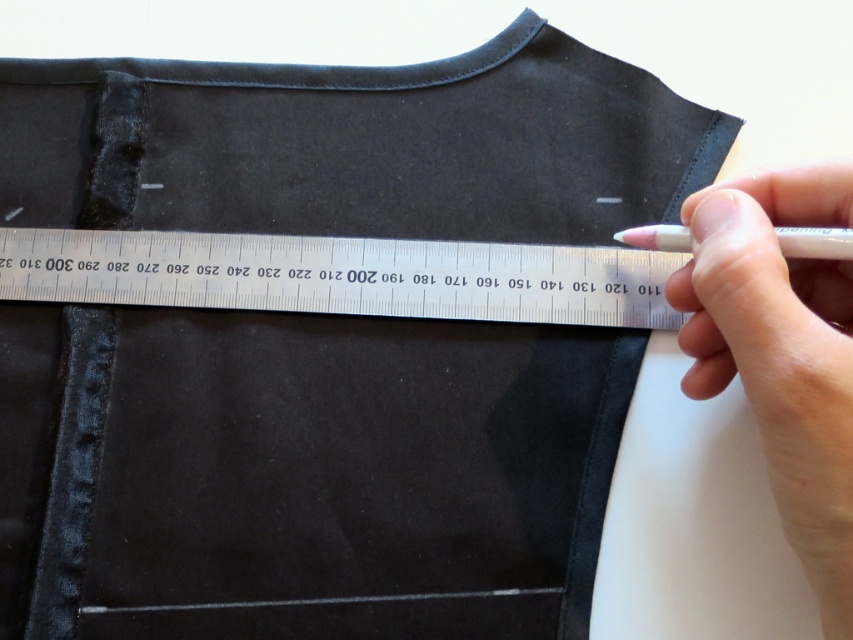
You are a tailor working on a black fabric piece. You need to mark a point exactly at the center of the metallic silver ruler at center. Where should you place the mark relative to the ruler?

The metallic silver ruler at center is located at point coordinates (346, 275), so you should place the mark at the center of the ruler at those coordinates.

You are a tailor who needs to mark a spot exactly 18 centimeters away from the metallic silver ruler at center. Can you use the white matte pen at upper right to make the mark without moving the ruler?

The white matte pen at upper right is 17.54 centimeters away from the metallic silver ruler at center. Since 17.54 cm is less than 18 cm, you can move the pen slightly away from the ruler to reach the desired 18 cm mark.

You need to choose between the metallic silver ruler at center and the pink plastic pen at upper right to measure a 15cm line on the fabric. Which object should you use and why?

You should use the metallic silver ruler at center to measure the 15cm line because its width is larger than the pink plastic pen at upper right, making it more suitable for accurate measurements.